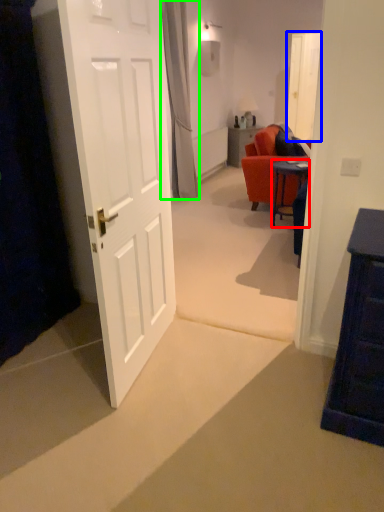
Question: Which object is the closest to the desk (highlighted by a red box)? Choose among these: glass door (highlighted by a blue box) or curtain (highlighted by a green box).

Choices:
 (A) glass door
 (B) curtain

Answer: (B)